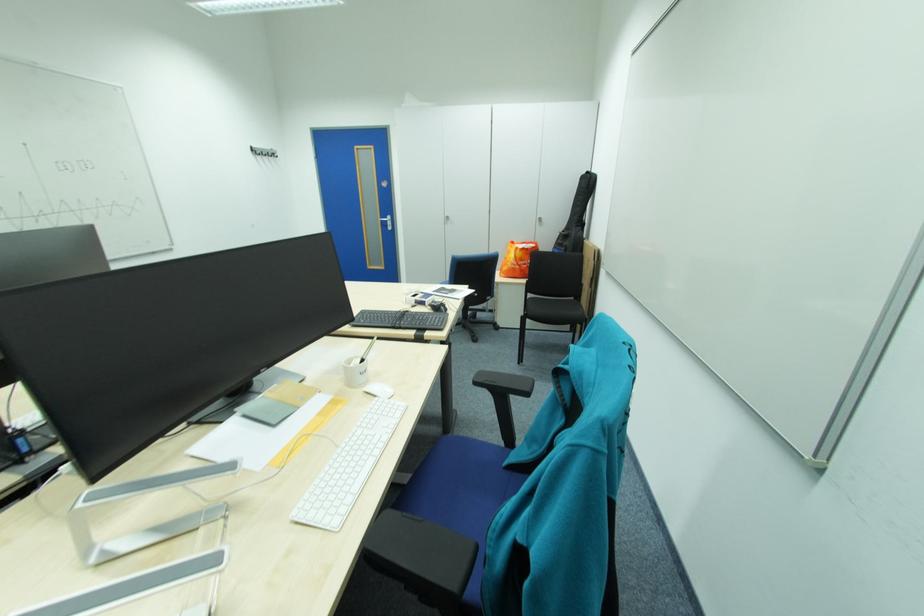
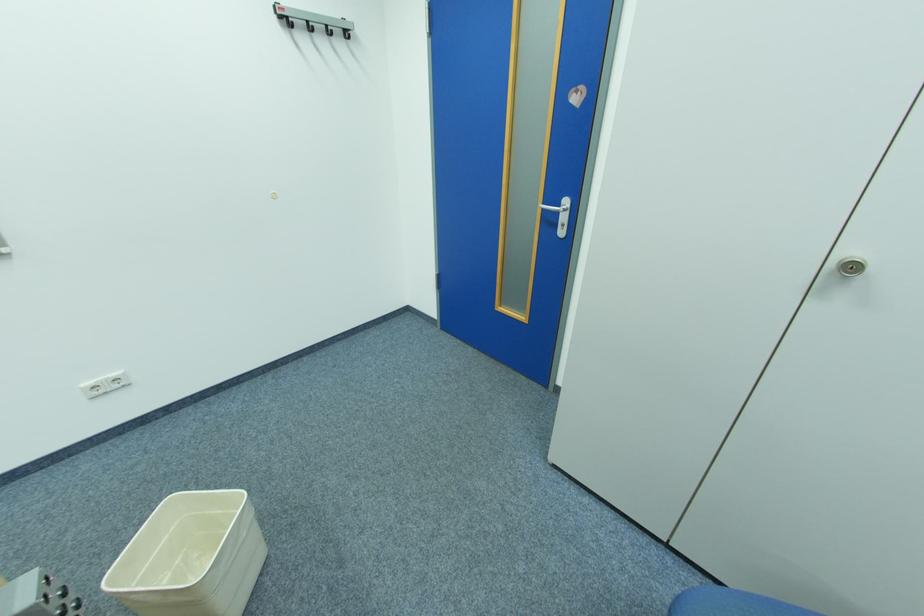
Find the pixel in the second image that matches the point at 390,221 in the first image.

(552, 209)